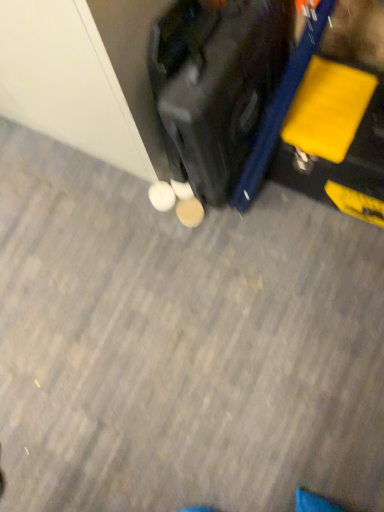
Question: Considering the positions of white matte shoe at center, positioned as the second footwear in right-to-left order, and white matte shoe at center, which ranks as the 2th footwear in left-to-right order, in the image, is white matte shoe at center, positioned as the second footwear in right-to-left order, bigger or smaller than white matte shoe at center, which ranks as the 2th footwear in left-to-right order,?

Choices:
 (A) small
 (B) big

Answer: (B)

Question: From the image's perspective, is white matte shoe at center, which is the first footwear in left-to-right order, located above or below white matte shoe at center, which ranks as the 2th footwear in left-to-right order?

Choices:
 (A) above
 (B) below

Answer: (A)

Question: Considering the real-world distances, which object is closest to the white matte shoe at center, positioned as the second footwear in right-to-left order?

Choices:
 (A) white matte shoe at center, which ranks as the 2th footwear in left-to-right order
 (B) shiny black suitcase at center

Answer: (A)

Question: Estimate the real-world distances between objects in this image. Which object is closer to the white matte shoe at center, the 1th footwear from the right?

Choices:
 (A) white matte shoe at center, positioned as the second footwear in right-to-left order
 (B) shiny black suitcase at center

Answer: (A)